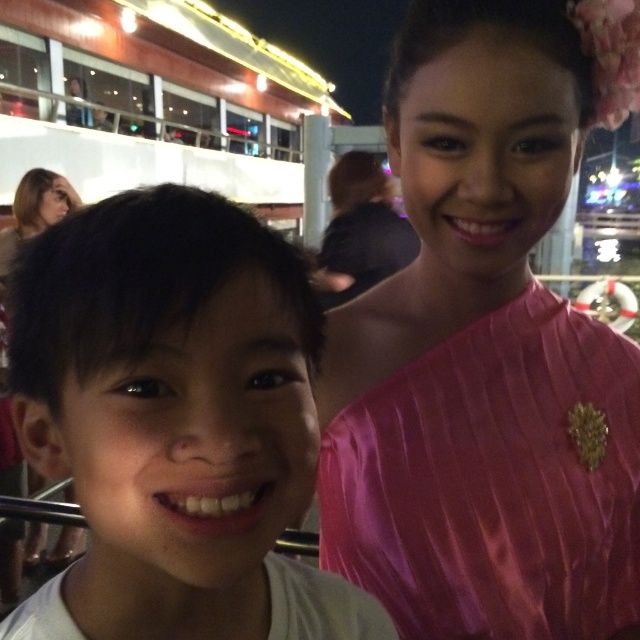
Can you confirm if white matte shirt at center is positioned to the right of pink satin brooch at upper right?

Incorrect, white matte shirt at center is not on the right side of pink satin brooch at upper right.

Is point (177, 554) farther from camera compared to point (449, 632)?

No, it is in front of (449, 632).

Locate an element on the screen. Image resolution: width=640 pixels, height=640 pixels. white matte shirt at center is located at coordinates (173, 422).